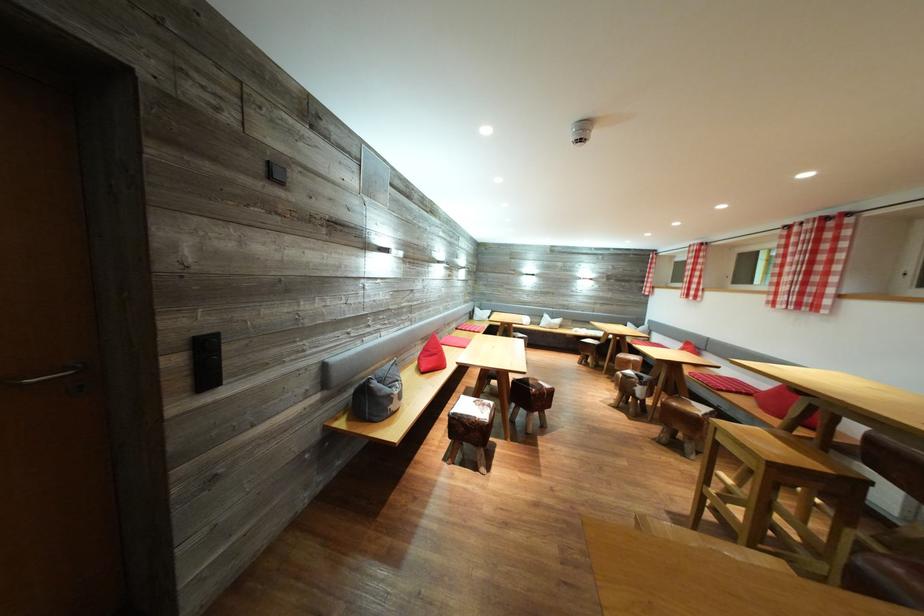
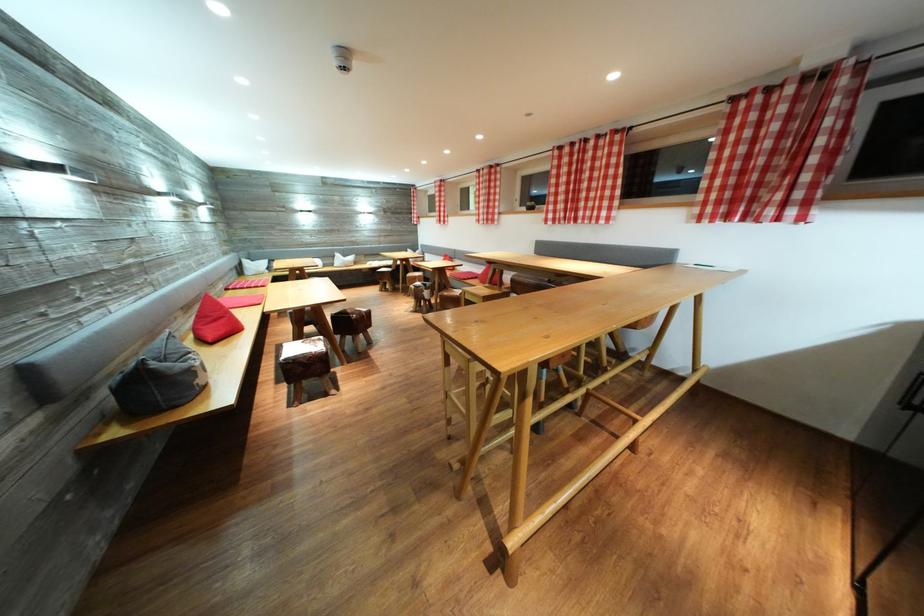
Where in the second image is the point corresponding to point (628, 361) from the first image?

(417, 280)